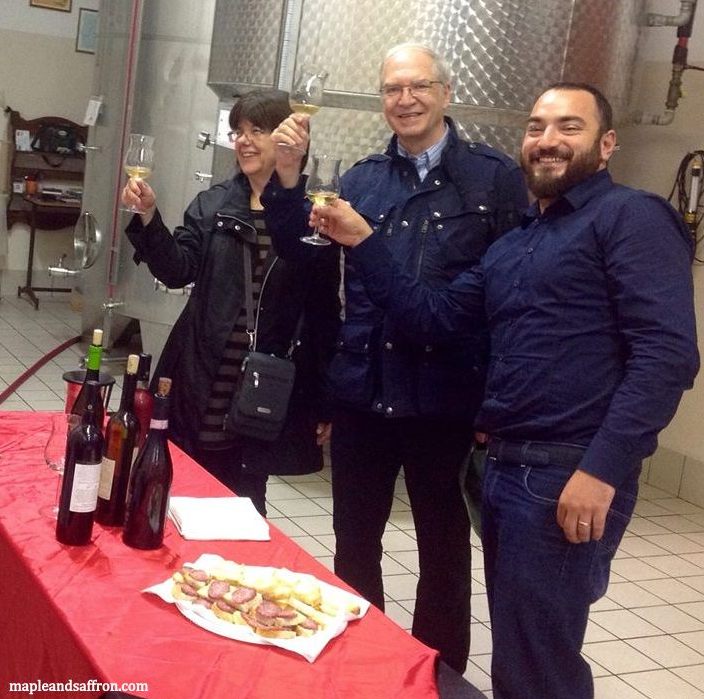
This screenshot has width=704, height=699. What are the coordinates of `wine bottles` in the screenshot? It's located at (82, 475), (94, 356), (132, 381), (142, 400), (151, 460).